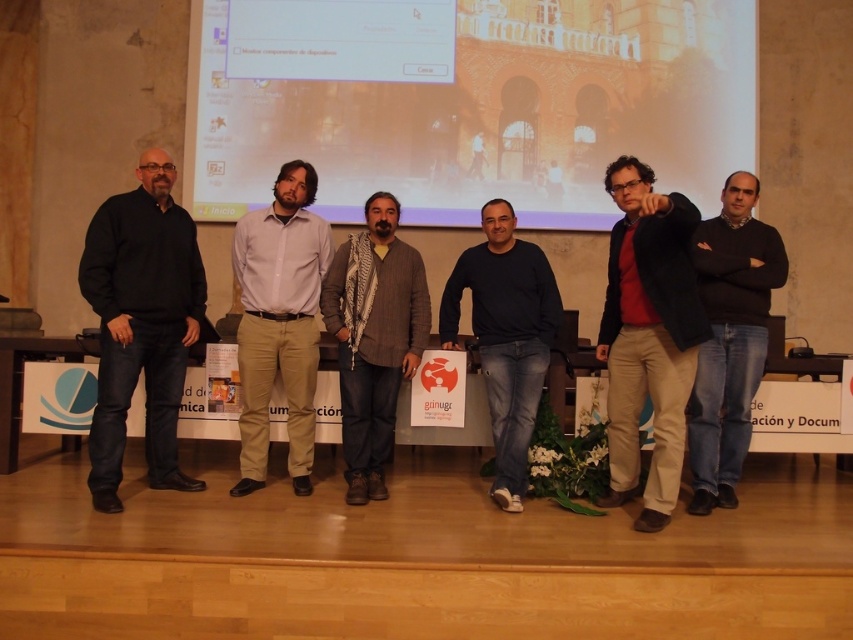
You are a photographer standing at the back of the stage. You need to adjust your camera focus to capture both the matte projector screen at upper center and the gray wool scarf at center. Which object should you focus on first to ensure both are in focus?

The matte projector screen at upper center is closer to you than the gray wool scarf at center. To ensure both are in focus, you should focus on the matte projector screen at upper center first, as it is the nearer object.

In the scene shown: You are a photographer who needs to focus on the matte black sweater at center and the dark blue sweater at center. Which one should you adjust your camera focus to first to ensure both are in focus?

The matte black sweater at center is closer to the viewer than the dark blue sweater at center. To ensure both are in focus, you should focus on the matte black sweater at center first, as it is closer, and then adjust the focus towards the dark blue sweater at center to cover the depth range between them.